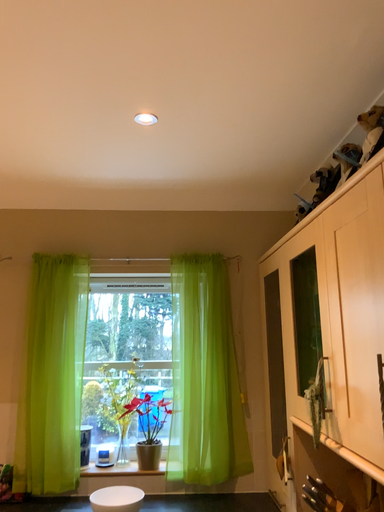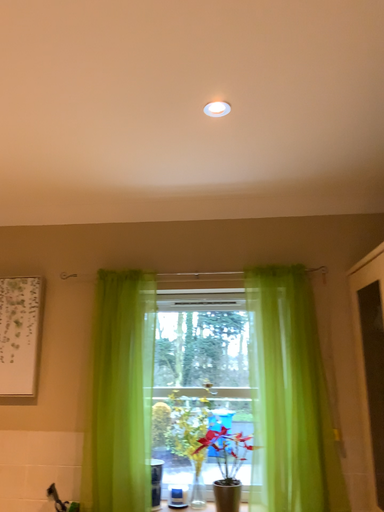
Question: How did the camera likely rotate when shooting the video?

Choices:
 (A) rotated right
 (B) rotated left

Answer: (B)